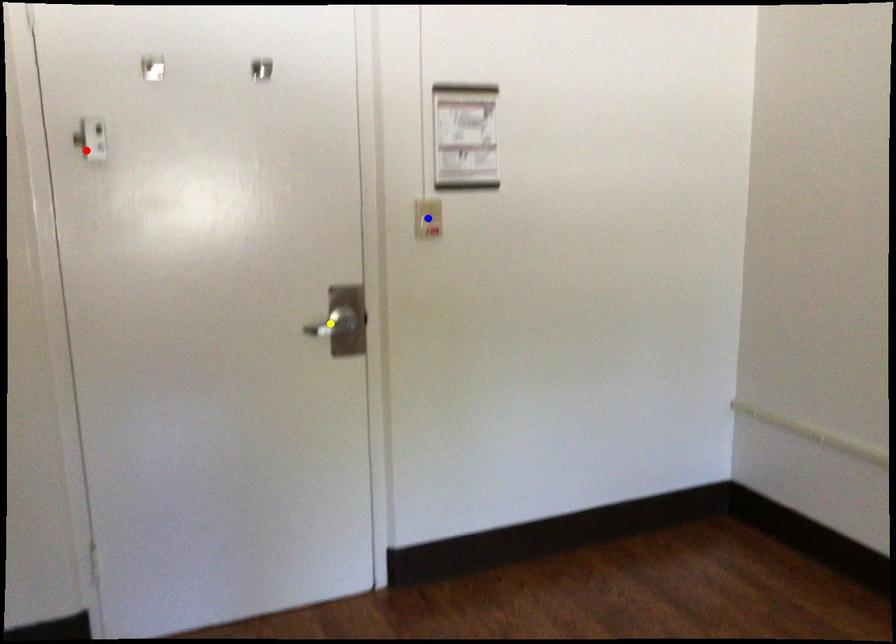
Order these from nearest to farthest:
red point
yellow point
blue point

blue point < yellow point < red point